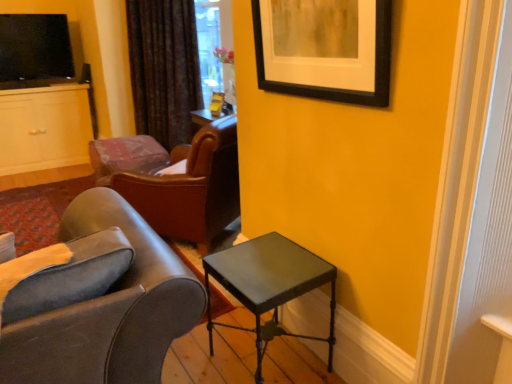
Question: From the image's perspective, relative to velvet dark brown curtain at upper center, is black matte picture frame at upper right above or below?

Choices:
 (A) above
 (B) below

Answer: (B)

Question: Considering the positions of black matte picture frame at upper right and velvet dark brown curtain at upper center in the image, is black matte picture frame at upper right wider or thinner than velvet dark brown curtain at upper center?

Choices:
 (A) thin
 (B) wide

Answer: (A)

Question: Considering the real-world distances, which object is farthest from the matte white cabinet at left?

Choices:
 (A) leather at left, the 1th chair when ordered from front to back
 (B) black matte picture frame at upper right
 (C) leather at center, acting as the 2th chair starting from the front
 (D) velvet dark brown curtain at upper center
 (E) metallic gray table at lower right

Answer: (B)

Question: Which of these objects is positioned closest to the velvet dark brown curtain at upper center?

Choices:
 (A) leather at center, acting as the 2th chair starting from the front
 (B) black matte picture frame at upper right
 (C) metallic gray table at lower right
 (D) leather at left, the 1th chair when ordered from front to back
 (E) matte white cabinet at left

Answer: (A)